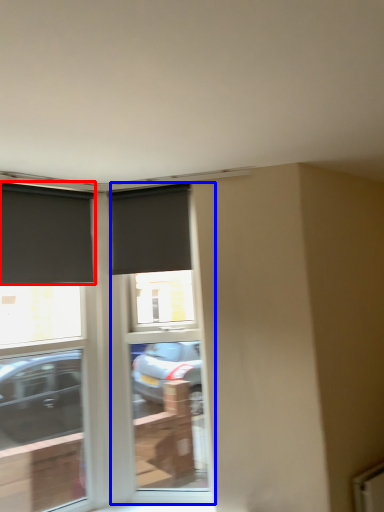
Question: Which object is further to the camera taking this photo, window (highlighted by a red box) or screen door (highlighted by a blue box)?

Choices:
 (A) window
 (B) screen door

Answer: (B)